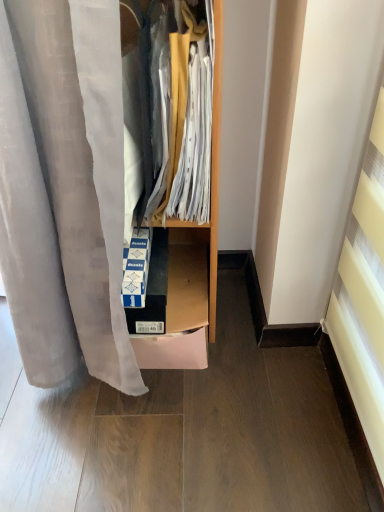
Question: In the image, is wooden cabinet at center on the left side or the right side of cardboard box at center?

Choices:
 (A) right
 (B) left

Answer: (A)

Question: From the image's perspective, is wooden cabinet at center above or below cardboard box at center?

Choices:
 (A) below
 (B) above

Answer: (B)

Question: Choose the correct answer: Is wooden cabinet at center inside cardboard box at center or outside it?

Choices:
 (A) inside
 (B) outside

Answer: (B)

Question: In the image, is cardboard box at center positioned in front of or behind wooden cabinet at center?

Choices:
 (A) front
 (B) behind

Answer: (B)

Question: From the image's perspective, relative to wooden cabinet at center, is cardboard box at center above or below?

Choices:
 (A) above
 (B) below

Answer: (B)

Question: Considering the relative positions of cardboard box at center and wooden cabinet at center in the image provided, is cardboard box at center to the left or to the right of wooden cabinet at center?

Choices:
 (A) left
 (B) right

Answer: (A)

Question: From a real-world perspective, is cardboard box at center above or below wooden cabinet at center?

Choices:
 (A) above
 (B) below

Answer: (B)